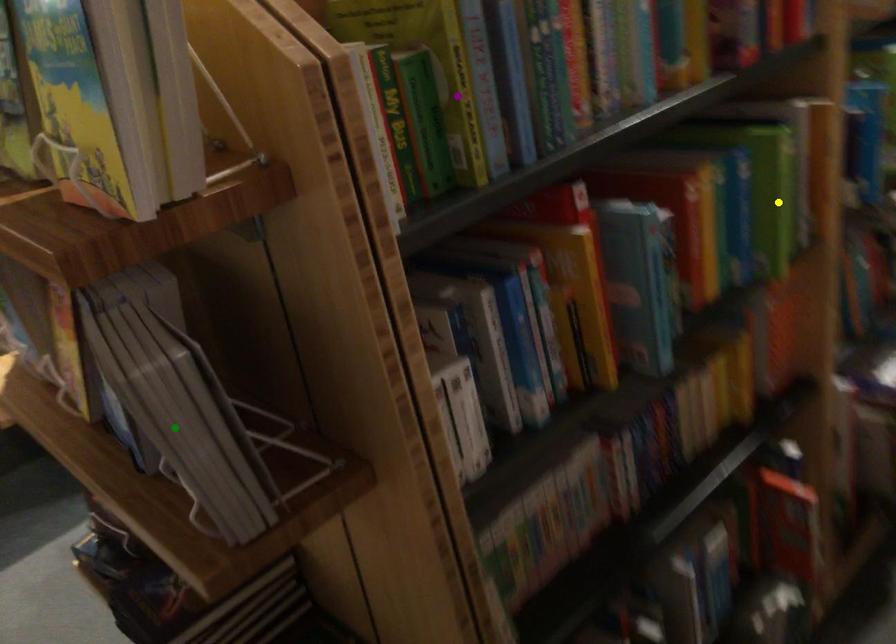
Order these from nearest to farthest:
green point, yellow point, purple point

green point
purple point
yellow point